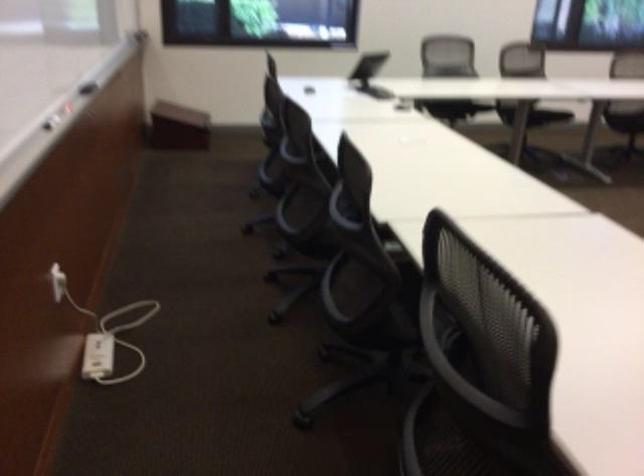
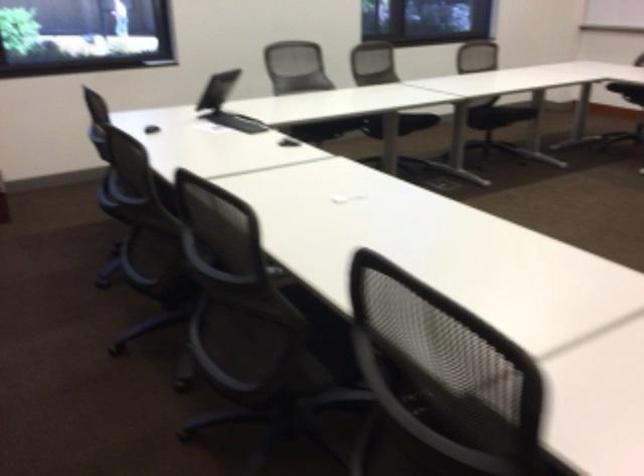
The first image is from the beginning of the video and the second image is from the end. How did the camera likely rotate when shooting the video?

The camera's rotation is toward right-down.